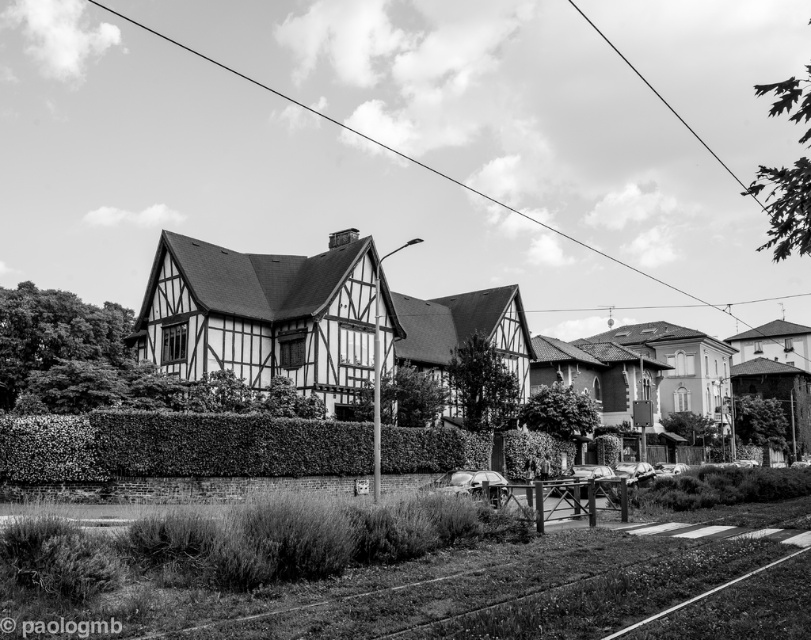
You are standing in front of the house and want to walk towards the green leafy hedge at center and the metallic wire at upper center. Which object will you reach first?

You will reach the green leafy hedge at center first because it is closer to you than the metallic wire at upper center.

You are a delivery person trying to navigate through the residential area shown in the image. You need to pass between the green leafy hedge at center and the metallic wire at upper center. Which direction should you move to avoid hitting the metallic wire?

To avoid hitting the metallic wire at upper center, you should move downward since the green leafy hedge at center is located below the metallic wire at upper center.